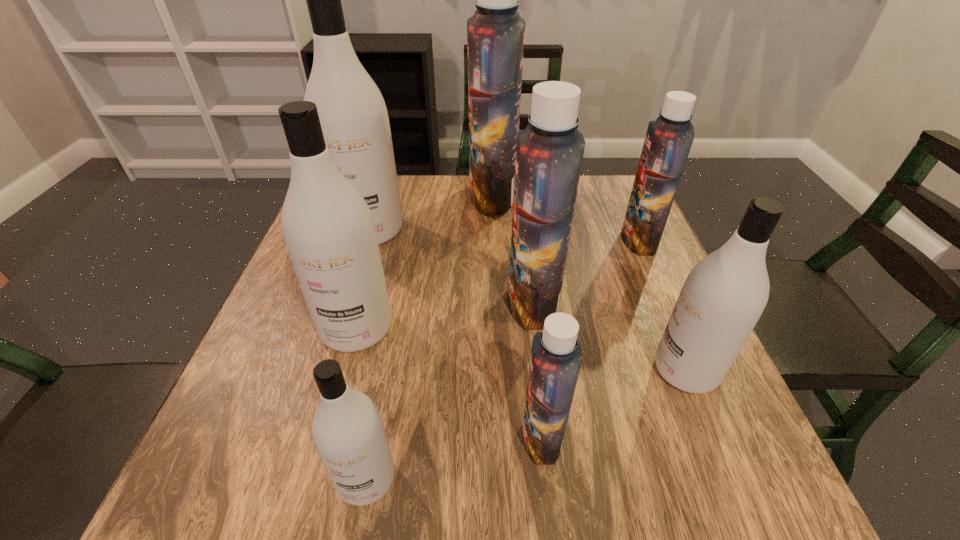
Where is `the farthest blue shampoo`? The height and width of the screenshot is (540, 960). the farthest blue shampoo is located at coordinates (495, 33).

The width and height of the screenshot is (960, 540). I want to click on the biggest white shampoo, so click(353, 116).

Where is `the third smallest blue shampoo`? the third smallest blue shampoo is located at coordinates (549, 153).

Find the location of `the second biggest white shampoo`. the second biggest white shampoo is located at coordinates (328, 228).

The width and height of the screenshot is (960, 540). In order to click on the second farthest blue shampoo in this screenshot , I will do `click(669, 138)`.

The image size is (960, 540). What are the coordinates of `the second smallest blue shampoo` in the screenshot? It's located at (669, 138).

You are a GUI agent. You are given a task and a screenshot of the screen. Output one action in this format:
    pyautogui.click(x=<x>, y=<y>)
    Task: Click on the rightmost white shampoo
    This screenshot has width=960, height=540.
    Given the screenshot: What is the action you would take?
    pyautogui.click(x=724, y=295)

Find the location of `the smallest blue shampoo`. the smallest blue shampoo is located at coordinates (556, 356).

Find the location of a particular element. the smallest white shampoo is located at coordinates pyautogui.click(x=347, y=429).

Identify the location of vacant area located on the front label of the farthest blue shampoo. The image size is (960, 540). (390, 197).